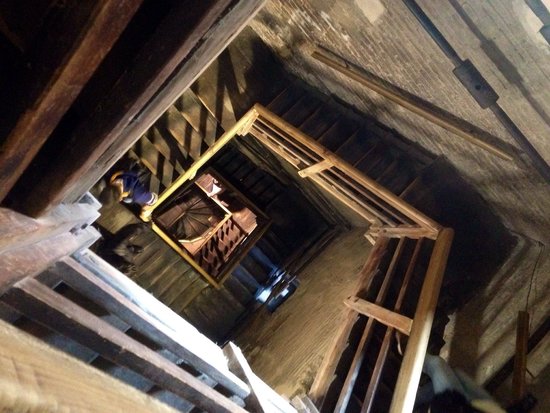
Where is `window light`? This screenshot has width=550, height=413. window light is located at coordinates (262, 299), (276, 278), (213, 191), (418, 364), (152, 307).